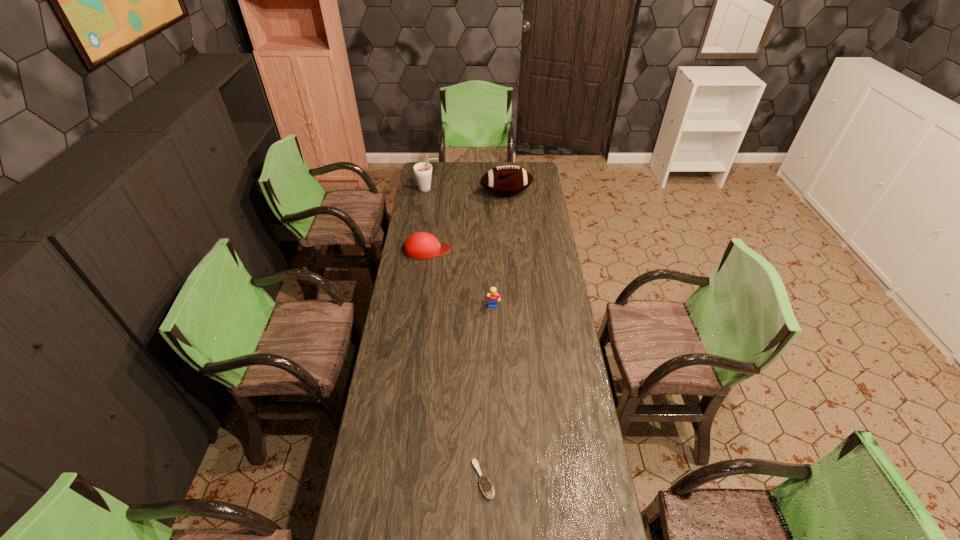
This screenshot has width=960, height=540. Find the location of `root beer`. root beer is located at coordinates (423, 171).

Locate an element on the screen. football (American) is located at coordinates (506, 180).

Find the location of a particular element. The height and width of the screenshot is (540, 960). the fourth farthest object is located at coordinates (493, 296).

Where is `the fourth tallest object`? Image resolution: width=960 pixels, height=540 pixels. the fourth tallest object is located at coordinates (420, 245).

The width and height of the screenshot is (960, 540). What are the coordinates of `baseball cap` in the screenshot? It's located at (420, 245).

Where is `scrubbing brush`? The width and height of the screenshot is (960, 540). scrubbing brush is located at coordinates (485, 485).

Locate an element on the screen. The height and width of the screenshot is (540, 960). the shortest object is located at coordinates (485, 485).

At what (x,y) coordinates should I click in order to perform the action: click on vacant space located on the drink side of the root beer. Please return your answer as a coordinate pair (x, y). Looking at the image, I should click on click(x=486, y=190).

This screenshot has width=960, height=540. Identify the location of free space located on the left of the football (American). (430, 194).

At what (x,y) coordinates should I click in order to perform the action: click on vacant point located on the face of the Lego. Please return your answer as a coordinate pair (x, y). Looking at the image, I should click on (494, 339).